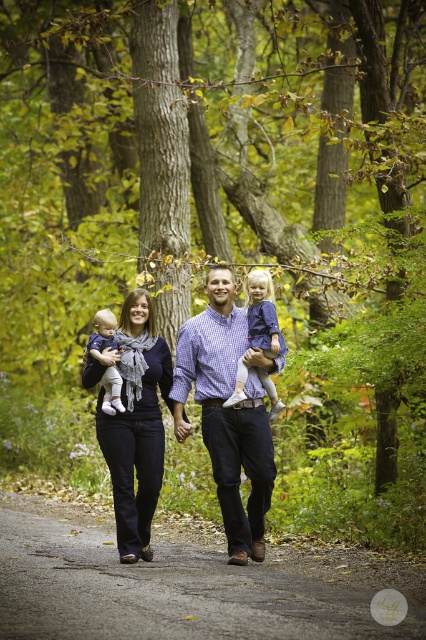
Does gray asphalt road at center have a greater height compared to dark blue jeans at center?

No.

In the scene shown: Measure the distance between gray asphalt road at center and camera.

gray asphalt road at center and camera are 8.08 meters apart.

Measure the distance between gray asphalt road at center and camera.

gray asphalt road at center and camera are 26.51 feet apart from each other.

The image size is (426, 640). What are the coordinates of `gray asphalt road at center` in the screenshot? It's located at coord(186,582).

Which is more to the right, gray asphalt road at center or matte blue dress at center?

matte blue dress at center

Does point (166, 566) come behind point (252, 340)?

No, it is in front of (252, 340).

The width and height of the screenshot is (426, 640). What are the coordinates of `gray asphalt road at center` in the screenshot? It's located at (186, 582).

Between dark blue jeans at center and matte blue dress at center, which one has less height?

Standing shorter between the two is matte blue dress at center.

Between point (164, 436) and point (255, 337), which one is positioned in front?

Positioned in front is point (164, 436).

Between point (144, 307) and point (264, 353), which one is positioned behind?

The point (144, 307) is behind.

The image size is (426, 640). Identify the location of dark blue jeans at center. (137, 426).